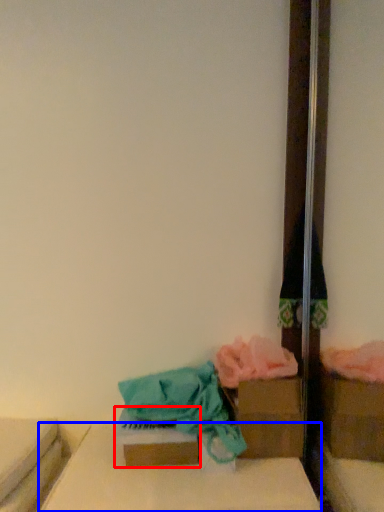
Question: Which point is further to the camera, storage box (highlighted by a red box) or furniture (highlighted by a blue box)?

Choices:
 (A) storage box
 (B) furniture

Answer: (A)